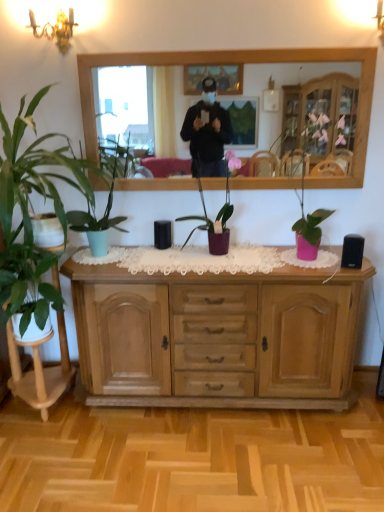
This screenshot has width=384, height=512. Identify the location of blank space situated above wooden mirror at upper center (from a real-world perspective). (229, 47).